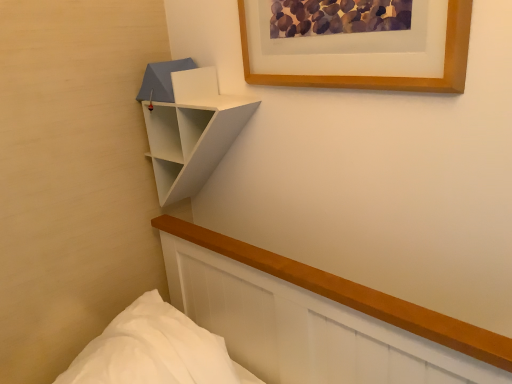
Question: Based on their sizes in the image, would you say wooden picture frame at upper center is bigger or smaller than white matte/shiny shelf at upper center?

Choices:
 (A) small
 (B) big

Answer: (A)

Question: From a real-world perspective, is wooden picture frame at upper center positioned above or below white matte/shiny shelf at upper center?

Choices:
 (A) below
 (B) above

Answer: (B)

Question: Considering the positions of point (456, 1) and point (226, 137), is point (456, 1) closer or farther from the camera than point (226, 137)?

Choices:
 (A) closer
 (B) farther

Answer: (A)

Question: Choose the correct answer: Is white matte/shiny shelf at upper center inside wooden picture frame at upper center or outside it?

Choices:
 (A) outside
 (B) inside

Answer: (A)

Question: Considering the positions of white matte/shiny shelf at upper center and wooden picture frame at upper center in the image, is white matte/shiny shelf at upper center taller or shorter than wooden picture frame at upper center?

Choices:
 (A) short
 (B) tall

Answer: (B)

Question: Looking at their shapes, would you say white matte/shiny shelf at upper center is wider or thinner than wooden picture frame at upper center?

Choices:
 (A) wide
 (B) thin

Answer: (A)

Question: Is white matte/shiny shelf at upper center in front of or behind wooden picture frame at upper center in the image?

Choices:
 (A) front
 (B) behind

Answer: (B)